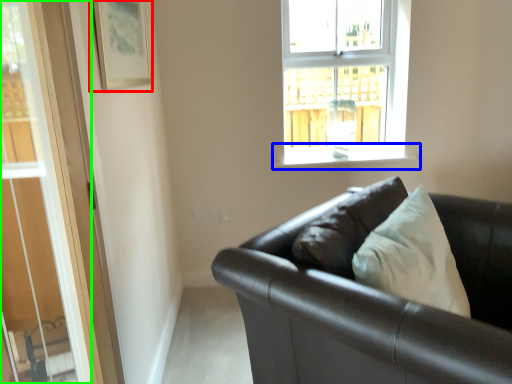
Question: Considering the real-world distances, which object is closest to picture frame (highlighted by a red box)? window sill (highlighted by a blue box) or glass door (highlighted by a green box).

Choices:
 (A) window sill
 (B) glass door

Answer: (B)